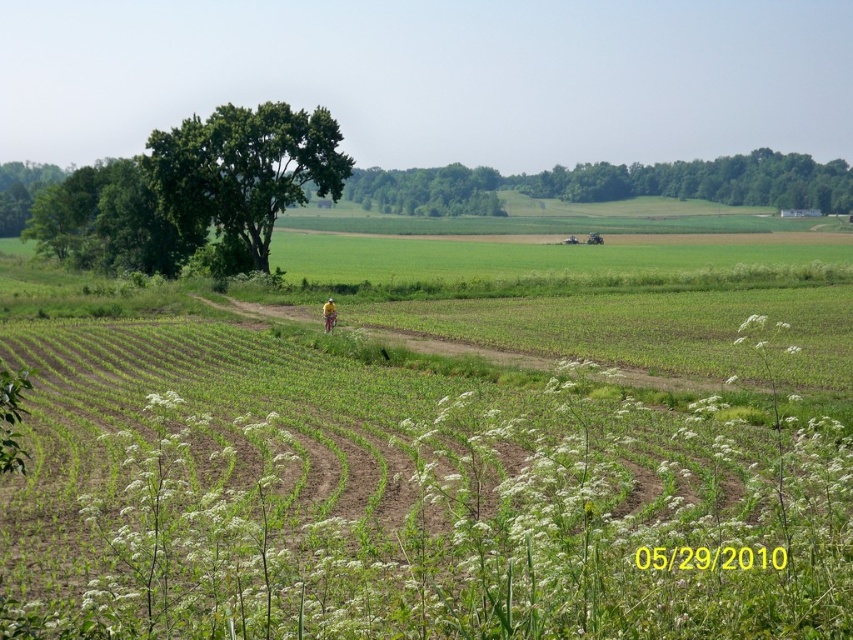
Question: Among these points, which one is farthest from the camera?

Choices:
 (A) (517, 188)
 (B) (457, 163)

Answer: (B)

Question: Is white fluffy plant at center below yellow fabric at center?

Choices:
 (A) yes
 (B) no

Answer: (A)

Question: Considering the real-world distances, which object is closest to the yellow fabric at center?

Choices:
 (A) white fluffy plant at center
 (B) green leafy tree at upper left
 (C) green leafy tree at upper center

Answer: (A)

Question: Considering the real-world distances, which object is closest to the green leafy tree at center?

Choices:
 (A) green leafy tree at upper center
 (B) green leafy tree at upper left

Answer: (A)

Question: Where is green leafy tree at upper center located in relation to yellow fabric at center in the image?

Choices:
 (A) right
 (B) left

Answer: (A)

Question: Is white fluffy plant at center thinner than green leafy tree at upper left?

Choices:
 (A) yes
 (B) no

Answer: (B)